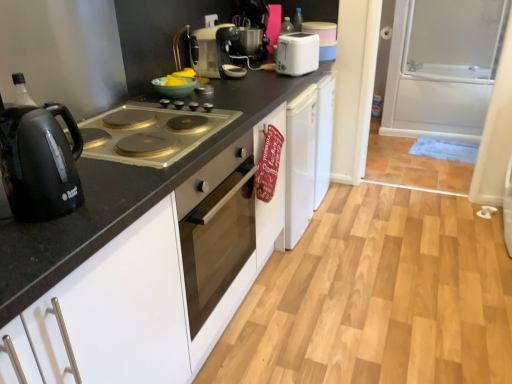
Question: Considering the relative sizes of matte black oven at center and black glossy electric kettle at left, which is the first kitchen appliance from bottom to top, in the image provided, is matte black oven at center bigger than black glossy electric kettle at left, which is the first kitchen appliance from bottom to top,?

Choices:
 (A) yes
 (B) no

Answer: (A)

Question: Does matte black oven at center have a smaller size compared to black glossy electric kettle at left, which is the first kitchen appliance from bottom to top?

Choices:
 (A) no
 (B) yes

Answer: (A)

Question: Does matte black oven at center have a greater width compared to black glossy electric kettle at left, which is the third kitchen appliance from right to left?

Choices:
 (A) no
 (B) yes

Answer: (B)

Question: Considering the relative positions of matte black oven at center and black glossy electric kettle at left, placed as the first kitchen appliance when sorted from front to back, in the image provided, is matte black oven at center to the right of black glossy electric kettle at left, placed as the first kitchen appliance when sorted from front to back, from the viewer's perspective?

Choices:
 (A) no
 (B) yes

Answer: (B)

Question: Is matte black oven at center next to black glossy electric kettle at left, positioned as the first kitchen appliance in left-to-right order?

Choices:
 (A) no
 (B) yes

Answer: (A)

Question: From a real-world perspective, is matte black oven at center beneath black glossy electric kettle at left, which is the third kitchen appliance from right to left?

Choices:
 (A) no
 (B) yes

Answer: (B)

Question: Is matte silver toaster at upper center, marked as the 2th kitchen appliance in a left-to-right arrangement, bigger than matte silver gas stove at left?

Choices:
 (A) no
 (B) yes

Answer: (A)

Question: From a real-world perspective, is matte silver toaster at upper center, the 2th kitchen appliance positioned from the front, below matte silver gas stove at left?

Choices:
 (A) no
 (B) yes

Answer: (A)

Question: Is matte silver toaster at upper center, the second kitchen appliance in the top-to-bottom sequence, not close to matte silver gas stove at left?

Choices:
 (A) no
 (B) yes

Answer: (A)

Question: From the image's perspective, is matte silver toaster at upper center, the second kitchen appliance positioned from the bottom, located above matte silver gas stove at left?

Choices:
 (A) no
 (B) yes

Answer: (B)

Question: Is matte silver toaster at upper center, which ranks as the 2th kitchen appliance in right-to-left order, at the right side of matte silver gas stove at left?

Choices:
 (A) yes
 (B) no

Answer: (A)

Question: Is matte silver toaster at upper center, positioned as the 2th kitchen appliance in back-to-front order, shorter than matte silver gas stove at left?

Choices:
 (A) no
 (B) yes

Answer: (A)

Question: Can black matte countertop at center be found inside matte silver toaster at upper center, positioned as the 2th kitchen appliance in back-to-front order?

Choices:
 (A) no
 (B) yes

Answer: (A)